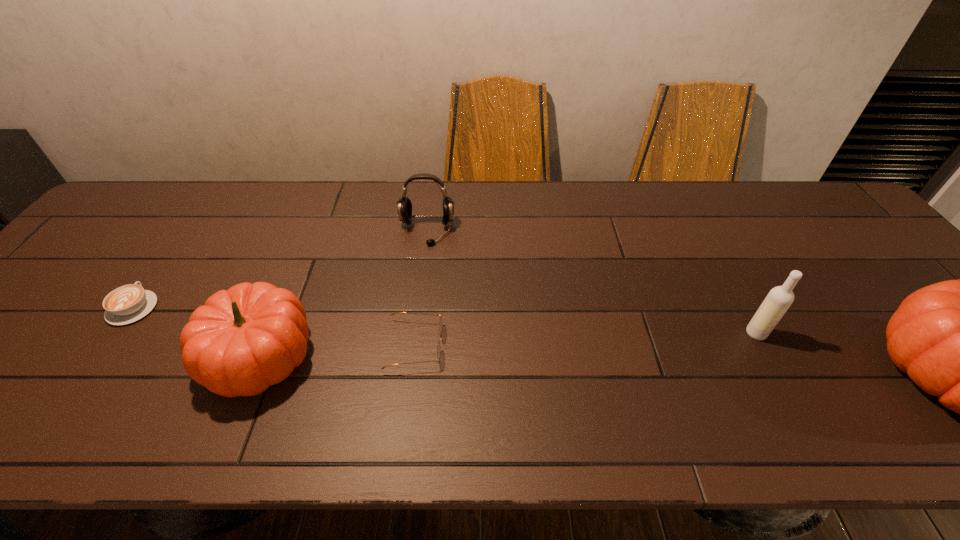
Image resolution: width=960 pixels, height=540 pixels. I want to click on vacant spot for a new pumpkin to ensure equal spacing, so click(x=601, y=366).